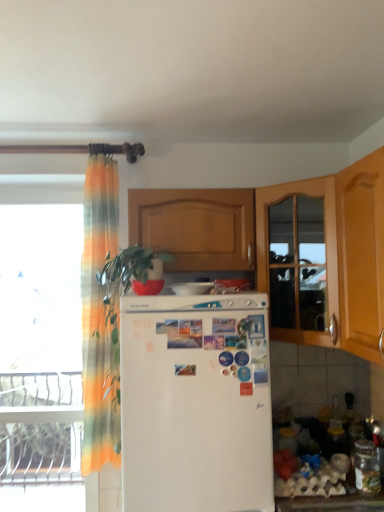
Question: Does wooden cabinet at center have a lesser width compared to transparent glass window at left?

Choices:
 (A) no
 (B) yes

Answer: (A)

Question: Is wooden cabinet at center at the right side of transparent glass window at left?

Choices:
 (A) yes
 (B) no

Answer: (A)

Question: Is wooden cabinet at center far from transparent glass window at left?

Choices:
 (A) no
 (B) yes

Answer: (B)

Question: Considering the relative sizes of wooden cabinet at center and transparent glass window at left in the image provided, is wooden cabinet at center shorter than transparent glass window at left?

Choices:
 (A) no
 (B) yes

Answer: (B)

Question: Is wooden cabinet at center taller than transparent glass window at left?

Choices:
 (A) yes
 (B) no

Answer: (B)

Question: From the image's perspective, is wooden cabinet at center on transparent glass window at left?

Choices:
 (A) yes
 (B) no

Answer: (A)

Question: Does transparent glass window at left have a larger size compared to white glossy refrigerator at center?

Choices:
 (A) no
 (B) yes

Answer: (B)

Question: From a real-world perspective, is transparent glass window at left located beneath white glossy refrigerator at center?

Choices:
 (A) no
 (B) yes

Answer: (B)

Question: Does transparent glass window at left appear on the left side of white glossy refrigerator at center?

Choices:
 (A) no
 (B) yes

Answer: (B)

Question: Considering the relative sizes of transparent glass window at left and white glossy refrigerator at center in the image provided, is transparent glass window at left wider than white glossy refrigerator at center?

Choices:
 (A) yes
 (B) no

Answer: (B)

Question: Can you confirm if transparent glass window at left is taller than white glossy refrigerator at center?

Choices:
 (A) yes
 (B) no

Answer: (A)

Question: Considering the relative sizes of transparent glass window at left and white glossy refrigerator at center in the image provided, is transparent glass window at left shorter than white glossy refrigerator at center?

Choices:
 (A) yes
 (B) no

Answer: (B)

Question: From the image's perspective, is white matte refrigerator at center under transparent glass window at left?

Choices:
 (A) yes
 (B) no

Answer: (A)